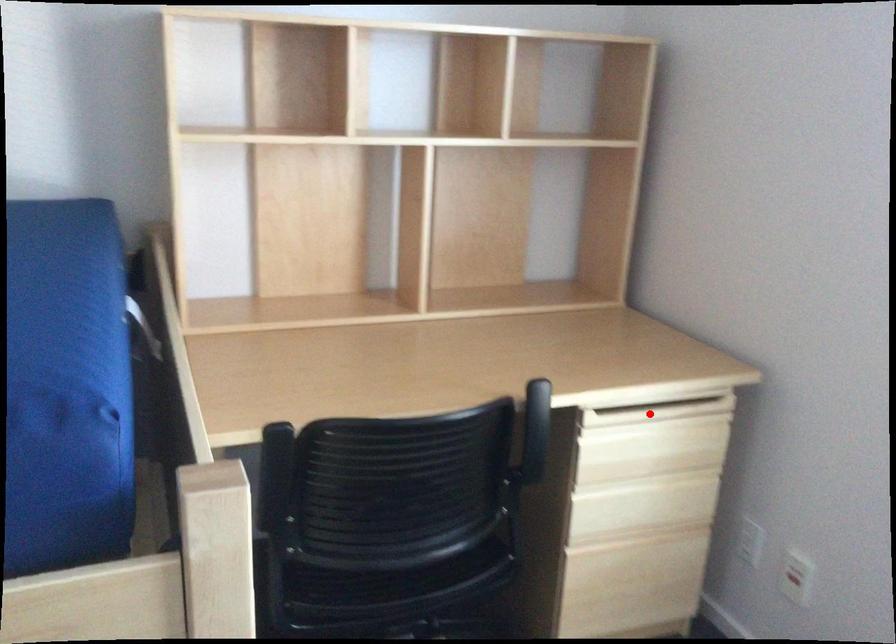
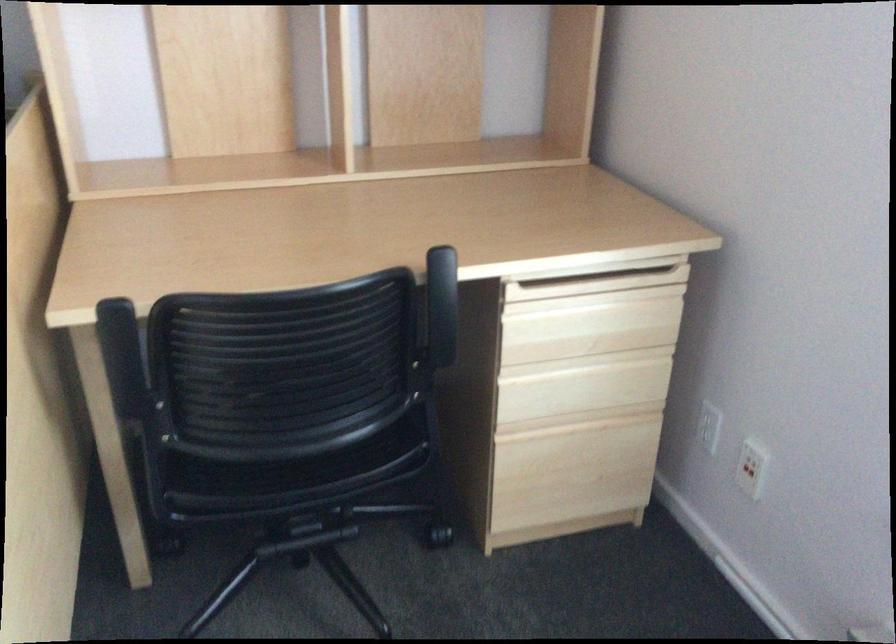
In the second image, find the point that corresponds to the highlighted location in the first image.

(587, 286)